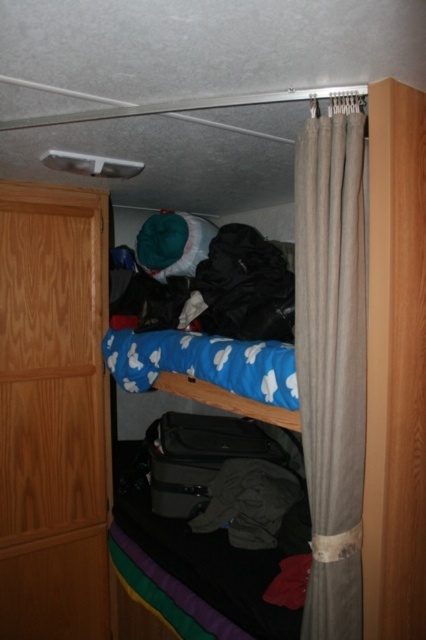
Question: Which point is farther from the camera taking this photo?

Choices:
 (A) (288, 499)
 (B) (351, 276)

Answer: (A)

Question: Estimate the real-world distances between objects in this image. Which object is closer to the gray cotton shirt at lower center?

Choices:
 (A) black fabric at center
 (B) beige fabric curtain at right

Answer: (A)

Question: Considering the real-world distances, which object is farthest from the gray cotton shirt at lower center?

Choices:
 (A) beige fabric curtain at right
 (B) black fabric at center

Answer: (A)

Question: Is beige fabric curtain at right below gray cotton shirt at lower center?

Choices:
 (A) no
 (B) yes

Answer: (A)

Question: Where is black fabric at center located in relation to gray cotton shirt at lower center in the image?

Choices:
 (A) above
 (B) below

Answer: (A)

Question: Does black fabric at center have a greater width compared to gray cotton shirt at lower center?

Choices:
 (A) yes
 (B) no

Answer: (B)